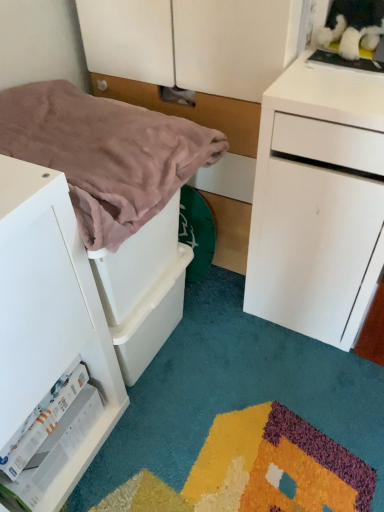
Question: Does matte white dresser at center have a greater width compared to pink soft blanket at left?

Choices:
 (A) yes
 (B) no

Answer: (B)

Question: Can you confirm if matte white dresser at center is positioned to the left of pink soft blanket at left?

Choices:
 (A) no
 (B) yes

Answer: (A)

Question: From a real-world perspective, is matte white dresser at center below pink soft blanket at left?

Choices:
 (A) yes
 (B) no

Answer: (A)

Question: Is matte white dresser at center far from pink soft blanket at left?

Choices:
 (A) no
 (B) yes

Answer: (A)

Question: Can you confirm if matte white dresser at center is positioned to the right of pink soft blanket at left?

Choices:
 (A) no
 (B) yes

Answer: (B)

Question: Can we say matte white dresser at center lies outside pink soft blanket at left?

Choices:
 (A) no
 (B) yes

Answer: (B)

Question: Does white matte drawer at left have a lesser height compared to pink soft blanket at left?

Choices:
 (A) no
 (B) yes

Answer: (A)

Question: From the image's perspective, is white matte drawer at left over pink soft blanket at left?

Choices:
 (A) no
 (B) yes

Answer: (A)

Question: Does white matte drawer at left have a lesser width compared to pink soft blanket at left?

Choices:
 (A) no
 (B) yes

Answer: (B)

Question: Is pink soft blanket at left located within white matte drawer at left?

Choices:
 (A) yes
 (B) no

Answer: (B)

Question: Does white matte drawer at left come behind pink soft blanket at left?

Choices:
 (A) no
 (B) yes

Answer: (A)

Question: Does white matte drawer at left have a greater width compared to pink soft blanket at left?

Choices:
 (A) yes
 (B) no

Answer: (B)

Question: From a real-world perspective, is white matte drawer at left on top of matte white dresser at center?

Choices:
 (A) yes
 (B) no

Answer: (B)